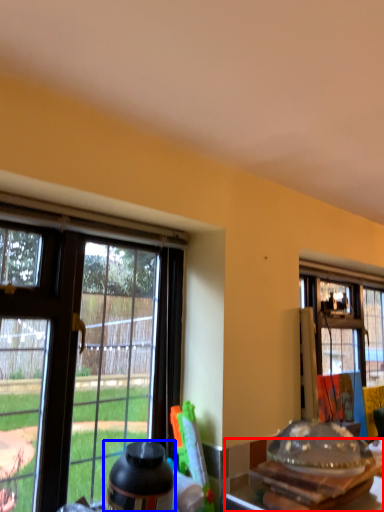
Question: Which point is further to the camera, kitchen & dining room table (highlighted by a red box) or bottle (highlighted by a blue box)?

Choices:
 (A) kitchen & dining room table
 (B) bottle

Answer: (B)